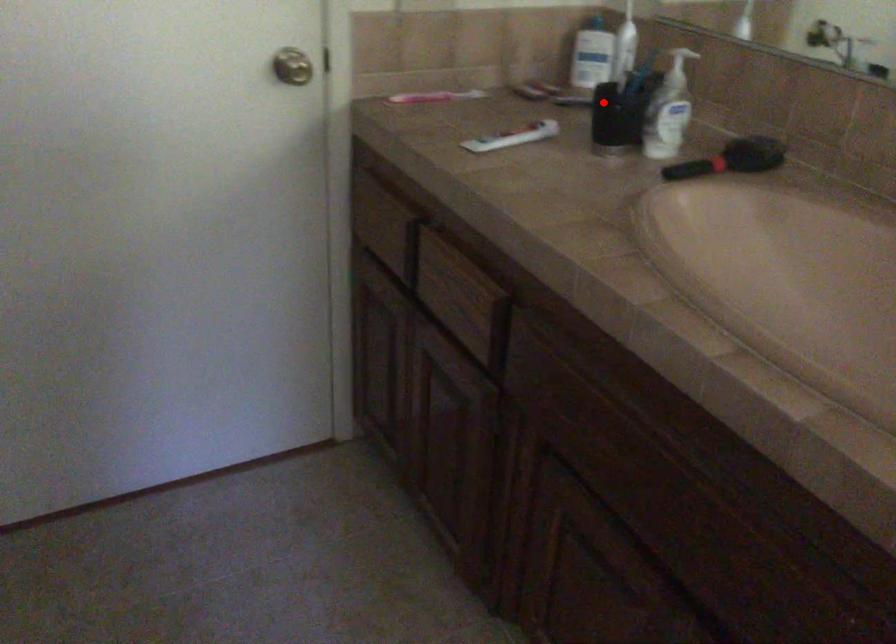
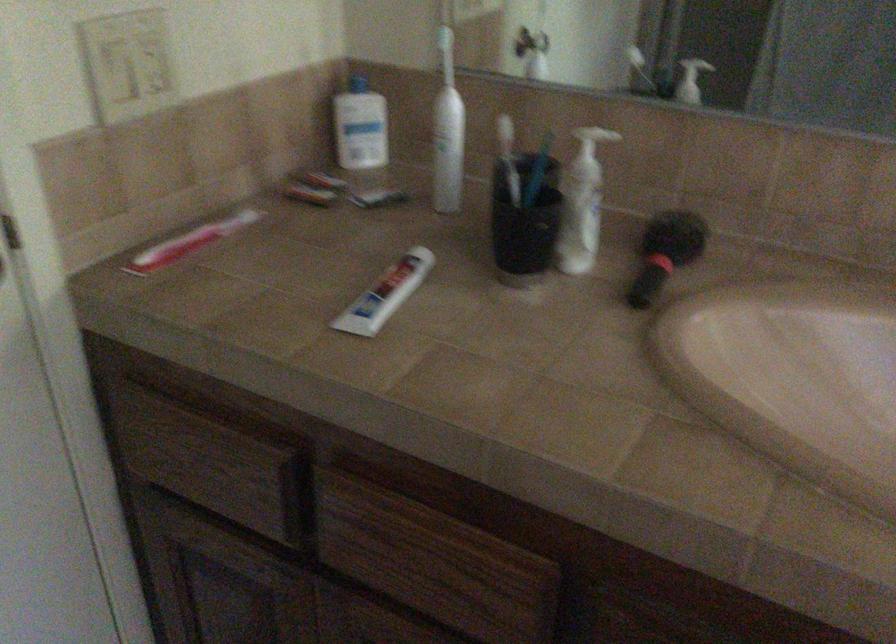
Where in the second image is the point corresponding to the highlighted location from the first image?

(524, 222)